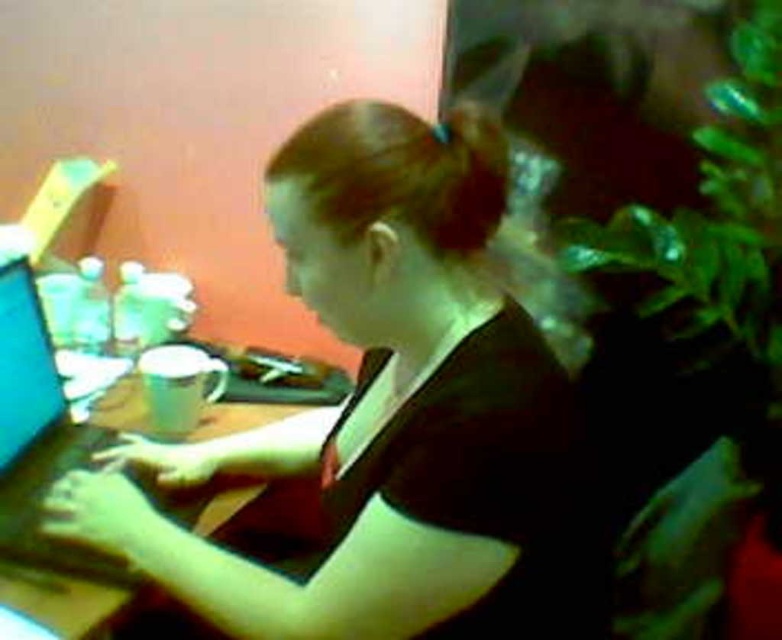
Can you confirm if matte black shirt at center is positioned below shiny blue laptop at left?

Actually, matte black shirt at center is above shiny blue laptop at left.

Identify the location of matte black shirt at center. The image size is (782, 640). (377, 403).

Between point (40, 592) and point (6, 550), which one is positioned behind?

Positioned behind is point (6, 550).

Can you confirm if wooden table at center is positioned above shiny blue laptop at left?

No, wooden table at center is not above shiny blue laptop at left.

The image size is (782, 640). What do you see at coordinates (59, 540) in the screenshot?
I see `wooden table at center` at bounding box center [59, 540].

At what (x,y) coordinates should I click in order to perform the action: click on wooden table at center. Please return your answer as a coordinate pair (x, y). The image size is (782, 640). Looking at the image, I should click on (59, 540).

Image resolution: width=782 pixels, height=640 pixels. Find the location of `matte black shirt at center`. matte black shirt at center is located at coordinates (377, 403).

Between matte black shirt at center and wooden table at center, which one is positioned lower?

wooden table at center

Where is `matte black shirt at center`? The height and width of the screenshot is (640, 782). matte black shirt at center is located at coordinates (377, 403).

Image resolution: width=782 pixels, height=640 pixels. I want to click on matte black shirt at center, so click(377, 403).